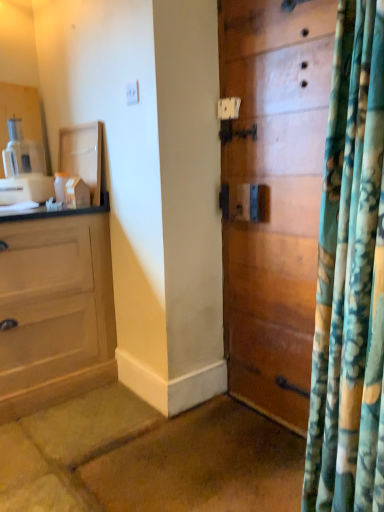
Describe the element at coordinates (24, 169) in the screenshot. The image size is (384, 512). I see `white plastic coffee machine at left` at that location.

This screenshot has height=512, width=384. I want to click on white plastic coffee machine at left, so click(x=24, y=169).

At what (x,y) coordinates should I click in order to perform the action: click on wooden door at center. Please return your answer as a coordinate pair (x, y). This screenshot has width=384, height=512. Looking at the image, I should click on (273, 196).

Image resolution: width=384 pixels, height=512 pixels. Describe the element at coordinates (273, 196) in the screenshot. I see `wooden door at center` at that location.

The width and height of the screenshot is (384, 512). What are the coordinates of `white plastic coffee machine at left` in the screenshot? It's located at (24, 169).

Does wooden door at center appear on the left side of white plastic coffee machine at left?

In fact, wooden door at center is to the right of white plastic coffee machine at left.

From the picture: Is wooden door at center further to camera compared to white plastic coffee machine at left?

No, wooden door at center is in front of white plastic coffee machine at left.

Which is less distant, [267,268] or [52,182]?

Clearly, point [267,268] is closer to the camera than point [52,182].

From the image's perspective, between wooden door at center and white plastic coffee machine at left, who is located below?

wooden door at center is shown below in the image.

From a real-world perspective, relative to white plastic coffee machine at left, is wooden door at center vertically above or below?

wooden door at center is situated lower than white plastic coffee machine at left in the real world.

Considering the relative sizes of wooden door at center and white plastic coffee machine at left in the image provided, is wooden door at center thinner than white plastic coffee machine at left?

Yes.

Considering the sizes of wooden door at center and white plastic coffee machine at left in the image, is wooden door at center taller or shorter than white plastic coffee machine at left?

In the image, wooden door at center appears to be taller than white plastic coffee machine at left.

Considering the sizes of objects wooden door at center and white plastic coffee machine at left in the image provided, who is bigger, wooden door at center or white plastic coffee machine at left?

With larger size is wooden door at center.

Is white plastic coffee machine at left completely or partially inside wooden door at center?

Actually, white plastic coffee machine at left is outside wooden door at center.

Is wooden door at center in contact with white plastic coffee machine at left?

No, wooden door at center is not next to white plastic coffee machine at left.

Could you tell me if wooden door at center is facing white plastic coffee machine at left?

No, wooden door at center is not aimed at white plastic coffee machine at left.

Measure the distance from wooden door at center to white plastic coffee machine at left.

wooden door at center is 1.19 meters from white plastic coffee machine at left.

Where is `door below the white plastic coffee machine at left (from a real-world perspective)`? The image size is (384, 512). door below the white plastic coffee machine at left (from a real-world perspective) is located at coordinates (273, 196).

Considering the relative positions of white plastic coffee machine at left and wooden door at center in the image provided, is white plastic coffee machine at left to the left of wooden door at center from the viewer's perspective?

Indeed, white plastic coffee machine at left is positioned on the left side of wooden door at center.

In the image, is white plastic coffee machine at left positioned in front of or behind wooden door at center?

In the image, white plastic coffee machine at left appears behind wooden door at center.

Which is less distant, (26, 148) or (314, 267)?

Point (26, 148) is positioned farther from the camera compared to point (314, 267).

From the image's perspective, would you say white plastic coffee machine at left is positioned over wooden door at center?

Yes, from the image's perspective, white plastic coffee machine at left is on top of wooden door at center.

From a real-world perspective, does white plastic coffee machine at left sit lower than wooden door at center?

No.

Looking at this image, between white plastic coffee machine at left and wooden door at center, which one has smaller width?

With smaller width is wooden door at center.

Considering the relative sizes of white plastic coffee machine at left and wooden door at center in the image provided, is white plastic coffee machine at left taller than wooden door at center?

No.

Looking at the image, does white plastic coffee machine at left seem bigger or smaller compared to wooden door at center?

Considering their sizes, white plastic coffee machine at left takes up less space than wooden door at center.

Consider the image. Is wooden door at center located within white plastic coffee machine at left?

Actually, wooden door at center is outside white plastic coffee machine at left.

Are white plastic coffee machine at left and wooden door at center far apart?

Yes, white plastic coffee machine at left and wooden door at center are located far from each other.

Could you tell me if white plastic coffee machine at left is facing wooden door at center?

No, white plastic coffee machine at left does not turn towards wooden door at center.

What are the coordinates of `coffee machine that appears behind the wooden door at center` in the screenshot? It's located at (24, 169).

Image resolution: width=384 pixels, height=512 pixels. I want to click on door lying below the white plastic coffee machine at left (from the image's perspective), so click(273, 196).

Identify the location of door on the right side of white plastic coffee machine at left. The image size is (384, 512). (273, 196).